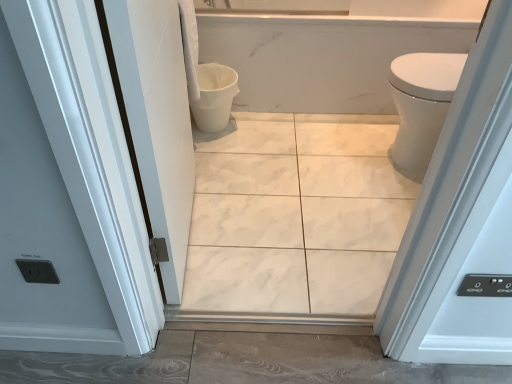
At what (x,y) coordinates should I click in order to perform the action: click on free space in front of white matte toilet bowl at center. Please return your answer as a coordinate pair (x, y). The height and width of the screenshot is (384, 512). Looking at the image, I should click on (220, 158).